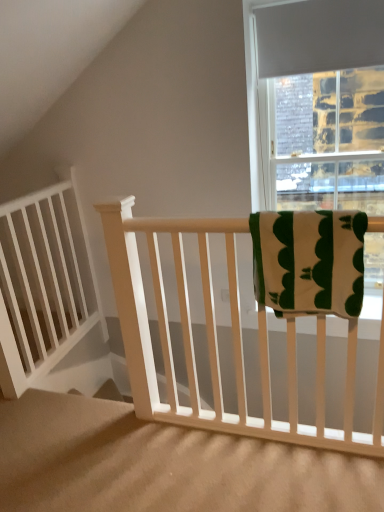
Question: From the image's perspective, does white wood stairs at center appear higher than white matte balustrade at left?

Choices:
 (A) yes
 (B) no

Answer: (B)

Question: Would you say white wood stairs at center is a long distance from white matte balustrade at left?

Choices:
 (A) yes
 (B) no

Answer: (B)

Question: Could you tell me if white wood stairs at center is turned towards white matte balustrade at left?

Choices:
 (A) yes
 (B) no

Answer: (B)

Question: Is white wood stairs at center surrounding white matte balustrade at left?

Choices:
 (A) yes
 (B) no

Answer: (B)

Question: Considering the relative sizes of white wood stairs at center and white matte balustrade at left in the image provided, is white wood stairs at center taller than white matte balustrade at left?

Choices:
 (A) no
 (B) yes

Answer: (A)

Question: Considering the relative sizes of white wood stairs at center and white matte balustrade at left in the image provided, is white wood stairs at center bigger than white matte balustrade at left?

Choices:
 (A) yes
 (B) no

Answer: (A)

Question: Is white wood stairs at center to the left of green cotton towel at upper right from the viewer's perspective?

Choices:
 (A) no
 (B) yes

Answer: (B)

Question: Is the depth of white wood stairs at center greater than that of green cotton towel at upper right?

Choices:
 (A) yes
 (B) no

Answer: (B)

Question: From the image's perspective, is white wood stairs at center under green cotton towel at upper right?

Choices:
 (A) yes
 (B) no

Answer: (A)

Question: Is white wood stairs at center at the right side of green cotton towel at upper right?

Choices:
 (A) no
 (B) yes

Answer: (A)

Question: Does white wood stairs at center have a greater width compared to green cotton towel at upper right?

Choices:
 (A) yes
 (B) no

Answer: (A)

Question: Is white wood stairs at center bigger than green cotton towel at upper right?

Choices:
 (A) yes
 (B) no

Answer: (A)

Question: From a real-world perspective, is white matte balustrade at left on white wood stairs at center?

Choices:
 (A) yes
 (B) no

Answer: (A)